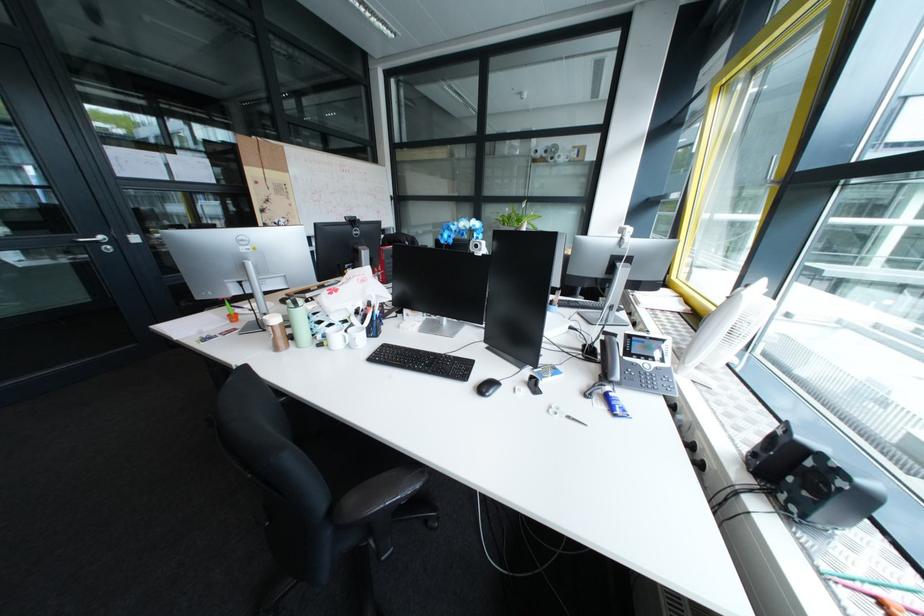
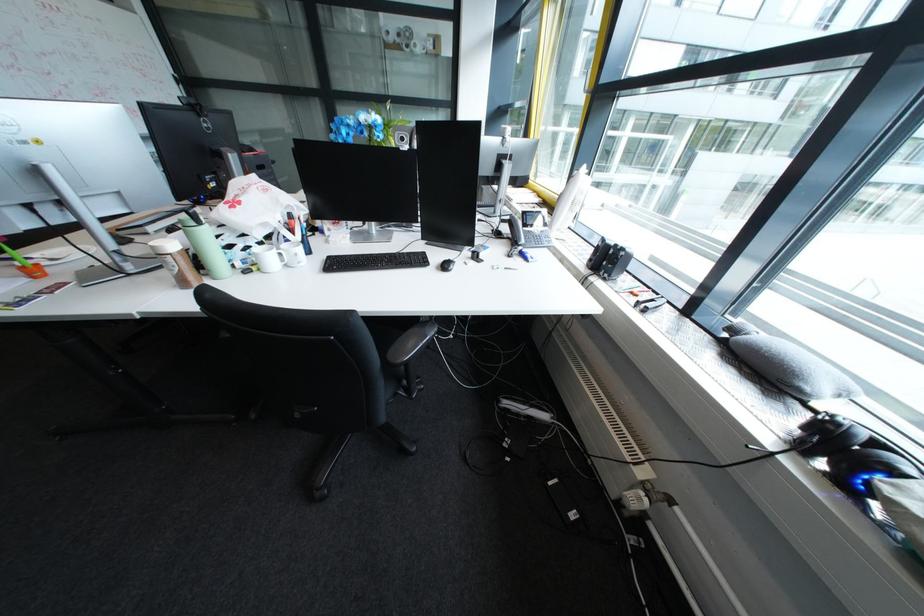
Where in the second image is the point corresponding to point (608, 342) from the first image?

(512, 228)